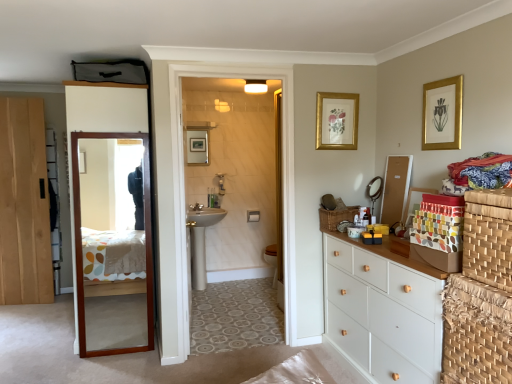
Question: Does gold/golden picture frame at upper right, which is counted as the first picture frame, starting from the right, come in front of natural wood door at left, which ranks as the second door in right-to-left order?

Choices:
 (A) yes
 (B) no

Answer: (A)

Question: From the image's perspective, is gold/golden picture frame at upper right, arranged as the 2th picture frame when viewed from the left, below natural wood door at left, which ranks as the second door in right-to-left order?

Choices:
 (A) no
 (B) yes

Answer: (A)

Question: Is gold/golden picture frame at upper right, arranged as the 2th picture frame when viewed from the left, taller than natural wood door at left, which ranks as the second door in right-to-left order?

Choices:
 (A) yes
 (B) no

Answer: (B)

Question: Considering the relative sizes of gold/golden picture frame at upper right, the first picture frame viewed from the front, and natural wood door at left, which ranks as the second door in right-to-left order, in the image provided, is gold/golden picture frame at upper right, the first picture frame viewed from the front, smaller than natural wood door at left, which ranks as the second door in right-to-left order,?

Choices:
 (A) yes
 (B) no

Answer: (A)

Question: Is gold/golden picture frame at upper right, which is counted as the 2th picture frame, starting from the back, thinner than natural wood door at left, marked as the 1th door in a left-to-right arrangement?

Choices:
 (A) no
 (B) yes

Answer: (B)

Question: From the image's perspective, is natural wood door at left, which ranks as the second door in right-to-left order, above or below brown woven basket at right?

Choices:
 (A) above
 (B) below

Answer: (A)

Question: Is natural wood door at left, marked as the 1th door in a left-to-right arrangement, in front of or behind brown woven basket at right in the image?

Choices:
 (A) behind
 (B) front

Answer: (A)

Question: Looking at the image, does natural wood door at left, marked as the 1th door in a left-to-right arrangement, seem bigger or smaller compared to brown woven basket at right?

Choices:
 (A) big
 (B) small

Answer: (A)

Question: Considering the positions of point (34, 233) and point (478, 215), is point (34, 233) closer or farther from the camera than point (478, 215)?

Choices:
 (A) closer
 (B) farther

Answer: (B)

Question: From the image's perspective, relative to gold/golden picture frame at upper right, the first picture frame viewed from the front, is brown wooden mirror at left, which is the first door in right-to-left order, above or below?

Choices:
 (A) below
 (B) above

Answer: (A)

Question: Is brown wooden mirror at left, which is the first door in right-to-left order, taller or shorter than gold/golden picture frame at upper right, which is counted as the first picture frame, starting from the right?

Choices:
 (A) tall
 (B) short

Answer: (A)

Question: Is brown wooden mirror at left, placed as the second door when sorted from left to right, in front of or behind gold/golden picture frame at upper right, which is counted as the 2th picture frame, starting from the back, in the image?

Choices:
 (A) behind
 (B) front

Answer: (A)

Question: In the image, is brown wooden mirror at left, which is the first door in right-to-left order, on the left side or the right side of gold/golden picture frame at upper right, arranged as the 2th picture frame when viewed from the left?

Choices:
 (A) right
 (B) left

Answer: (B)

Question: Is natural wood door at left, marked as the 1th door in a left-to-right arrangement, taller or shorter than woven brown basket at right, which ranks as the first basket in top-to-bottom order?

Choices:
 (A) short
 (B) tall

Answer: (B)

Question: From a real-world perspective, is natural wood door at left, which ranks as the second door in right-to-left order, above or below woven brown basket at right, which ranks as the 2th basket in right-to-left order?

Choices:
 (A) below
 (B) above

Answer: (B)